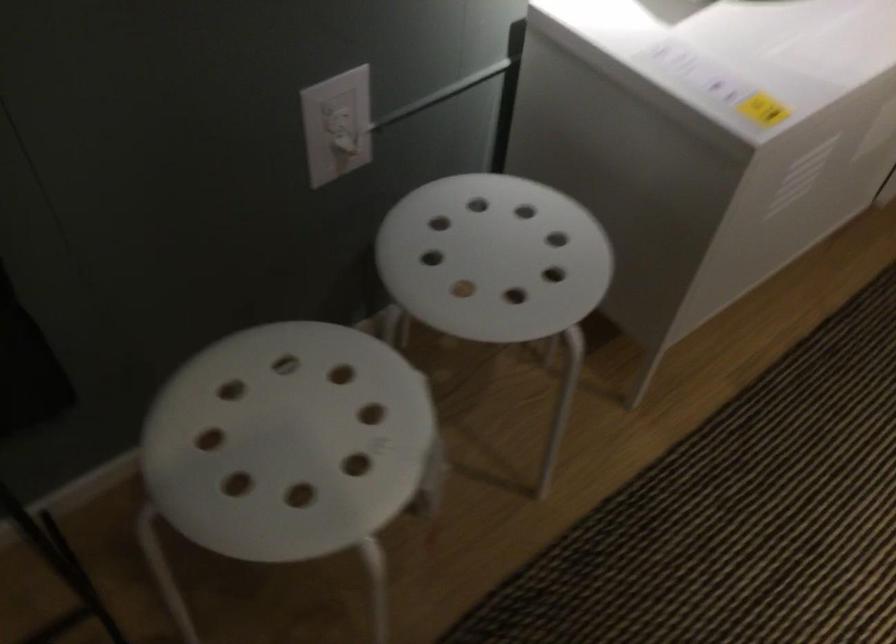
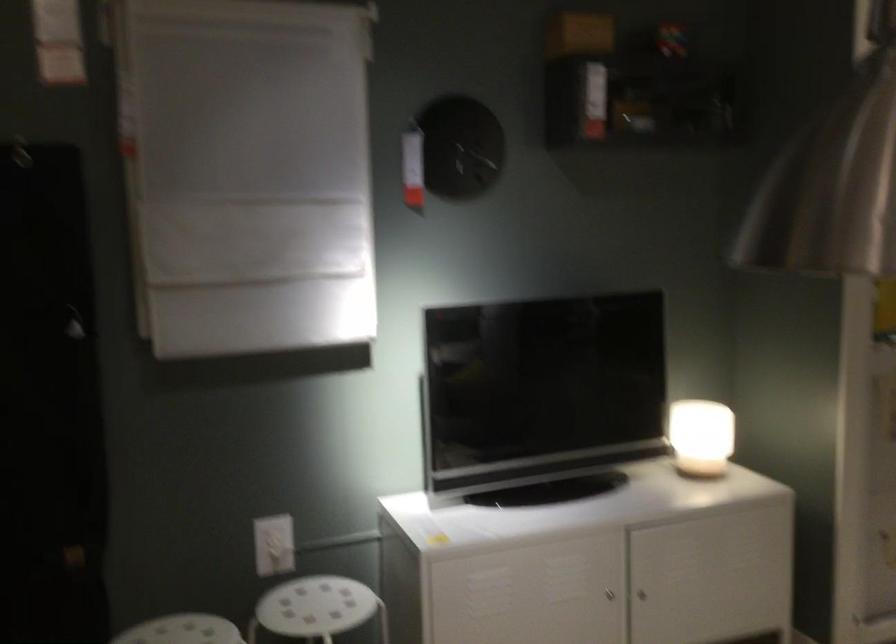
The point at [261,366] is marked in the first image. Where is the corresponding point in the second image?

(182, 630)